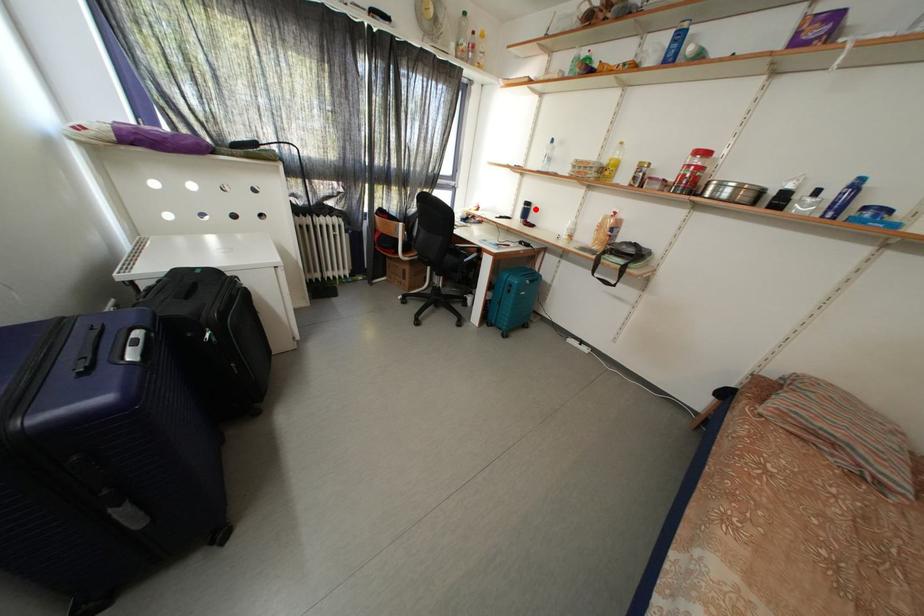
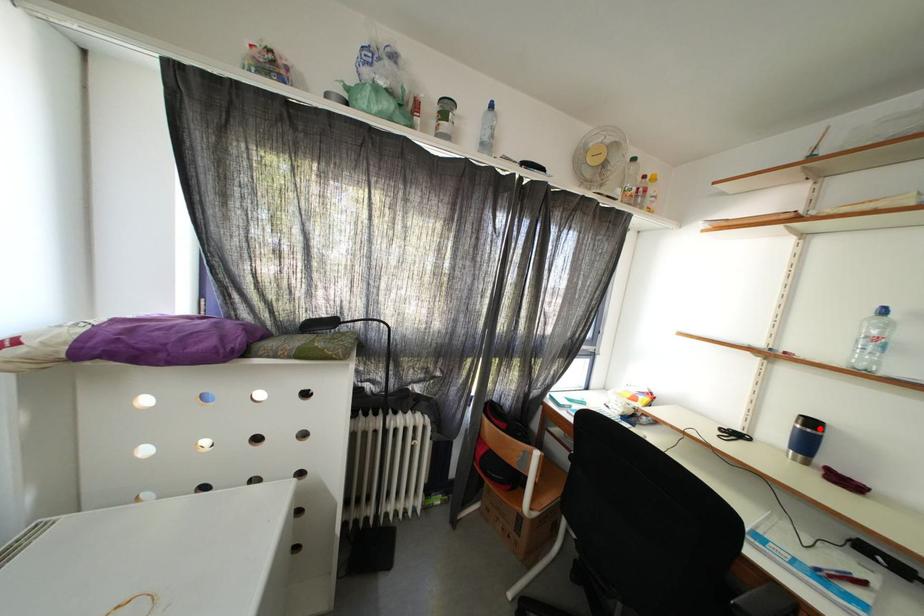
I am providing you with two images of the same scene from different viewpoints. A red point is marked on the first image and another point is marked on the second image. Is the marked point in image1 the same physical position as the marked point in image2?

Yes